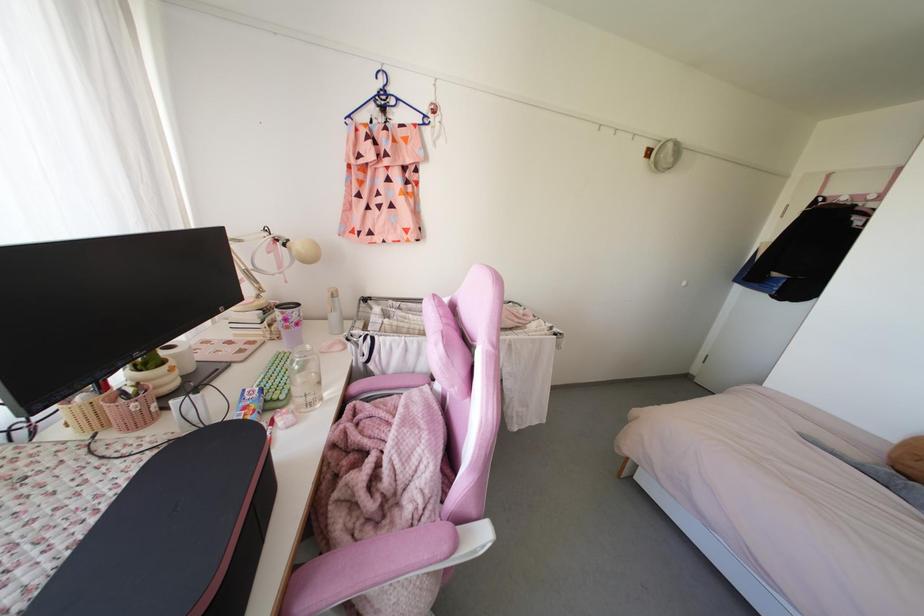
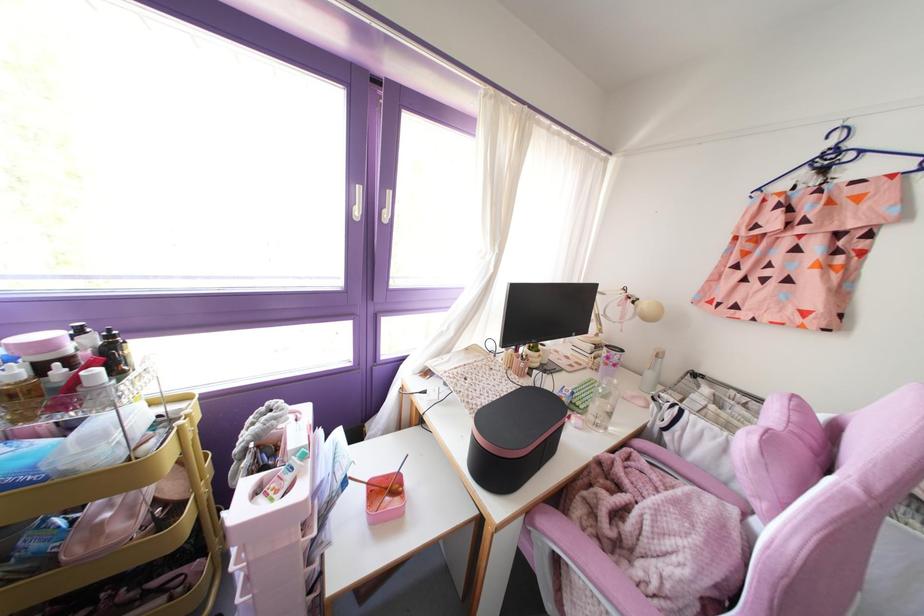
Find the pixel in the second image that matches point (220, 229) in the first image.

(594, 285)